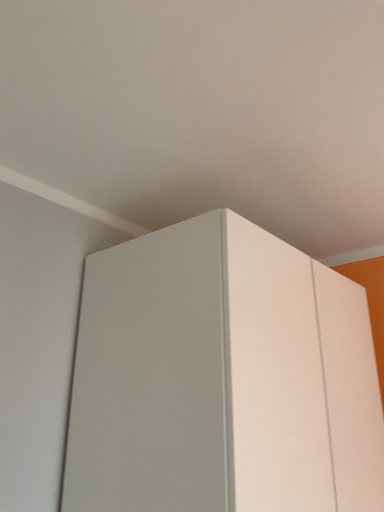
Where is `white matte cabinet at center`? white matte cabinet at center is located at coordinates (222, 378).

Describe the element at coordinates (222, 378) in the screenshot. I see `white matte cabinet at center` at that location.

You are a GUI agent. You are given a task and a screenshot of the screen. Output one action in this format:
    pyautogui.click(x=<x>, y=<y>)
    Task: Click on the white matte cabinet at center
    The image size is (384, 512).
    Given the screenshot: What is the action you would take?
    pyautogui.click(x=222, y=378)